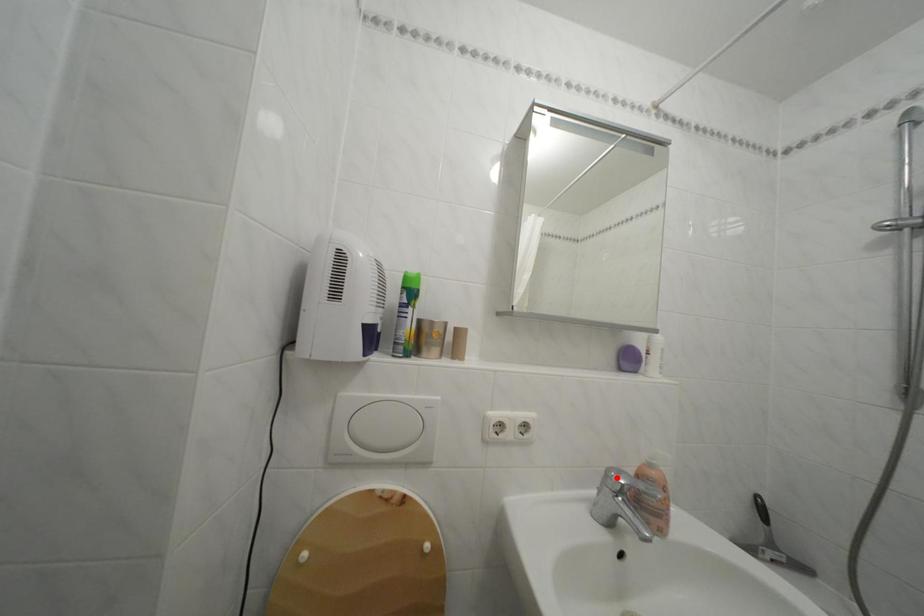
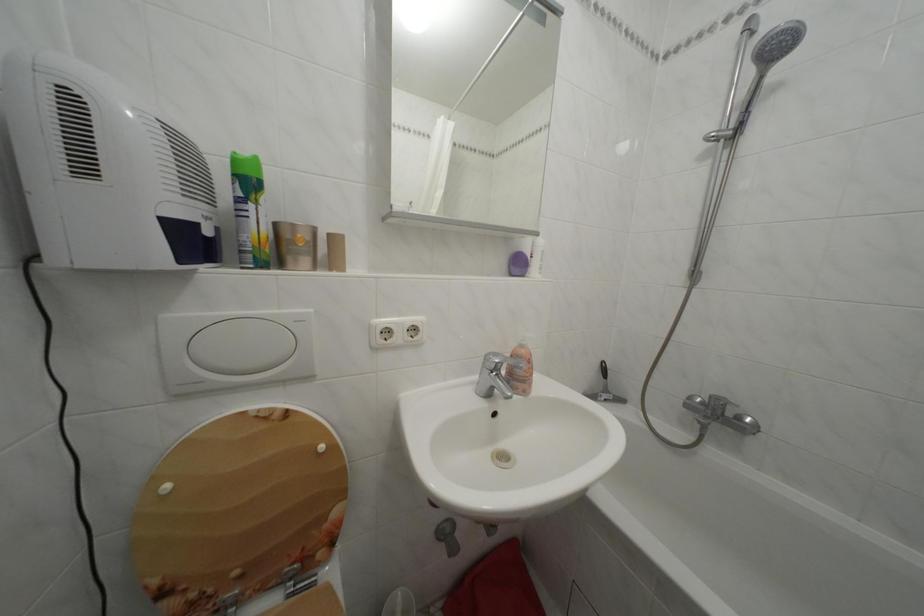
Where in the second image is the point corresponding to the highlighted location from the first image?

(495, 362)